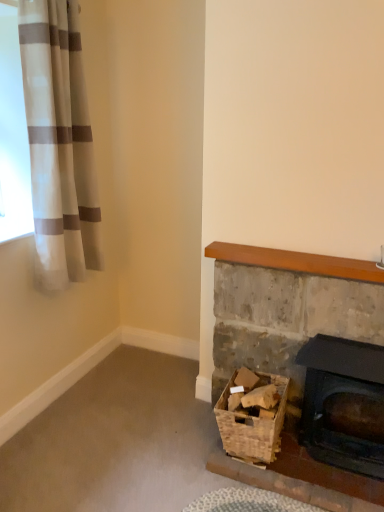
Locate an element on the screen. This screenshot has width=384, height=512. free space in front of woven brown basket at lower right is located at coordinates (257, 492).